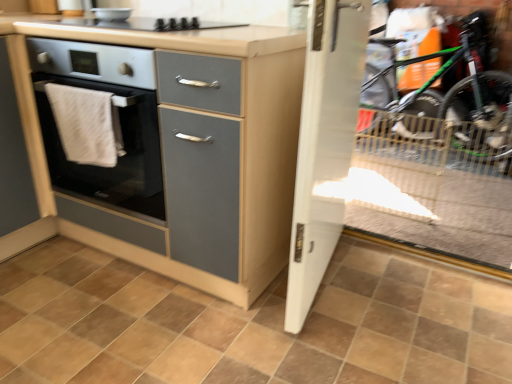
Question: Is matte gray cabinet at left positioned in front of matte gray cabinet at center?

Choices:
 (A) no
 (B) yes

Answer: (A)

Question: Is matte gray cabinet at center at the back of matte gray cabinet at left?

Choices:
 (A) no
 (B) yes

Answer: (A)

Question: Does matte gray cabinet at left have a larger size compared to matte gray cabinet at center?

Choices:
 (A) no
 (B) yes

Answer: (A)

Question: From a real-world perspective, is matte gray cabinet at left on matte gray cabinet at center?

Choices:
 (A) no
 (B) yes

Answer: (A)

Question: From the image's perspective, is matte gray cabinet at left beneath matte gray cabinet at center?

Choices:
 (A) no
 (B) yes

Answer: (B)

Question: Considering the positions of white cloth at left and transparent glass door at right in the image, is white cloth at left wider or thinner than transparent glass door at right?

Choices:
 (A) wide
 (B) thin

Answer: (B)

Question: In terms of size, does white cloth at left appear bigger or smaller than transparent glass door at right?

Choices:
 (A) small
 (B) big

Answer: (A)

Question: From the image's perspective, relative to transparent glass door at right, is white cloth at left above or below?

Choices:
 (A) below
 (B) above

Answer: (A)

Question: Is white cloth at left taller or shorter than transparent glass door at right?

Choices:
 (A) tall
 (B) short

Answer: (A)

Question: Would you say transparent glass door at right is to the left or to the right of white cloth at left in the picture?

Choices:
 (A) left
 (B) right

Answer: (B)

Question: Is point (505, 261) positioned closer to the camera than point (106, 112)?

Choices:
 (A) farther
 (B) closer

Answer: (A)

Question: Would you say transparent glass door at right is inside or outside white cloth at left?

Choices:
 (A) inside
 (B) outside

Answer: (B)

Question: Relative to white cloth at left, is transparent glass door at right in front or behind?

Choices:
 (A) behind
 (B) front

Answer: (A)

Question: From the image's perspective, is brown matte tile at center positioned above or below white glossy door at center?

Choices:
 (A) below
 (B) above

Answer: (A)

Question: From a real-world perspective, is brown matte tile at center above or below white glossy door at center?

Choices:
 (A) below
 (B) above

Answer: (A)